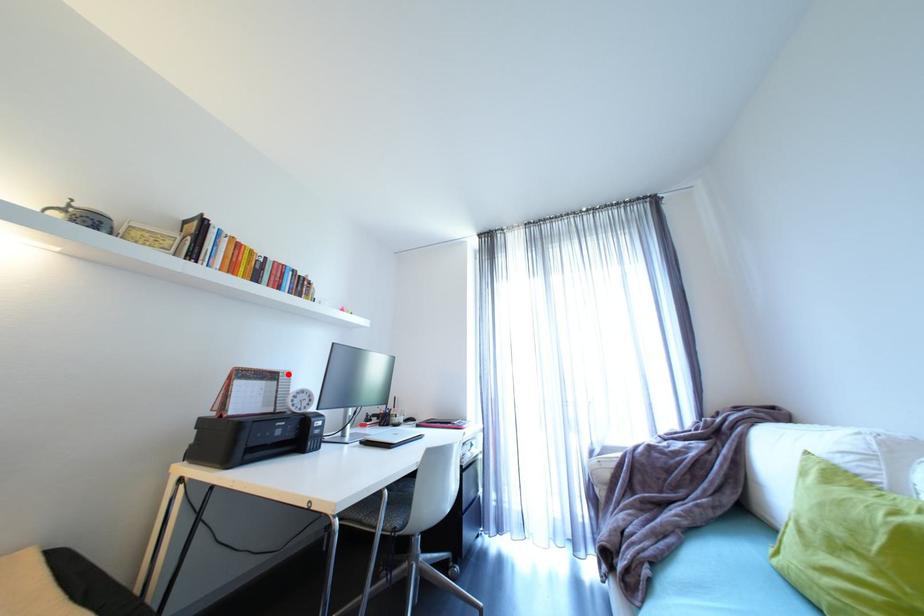
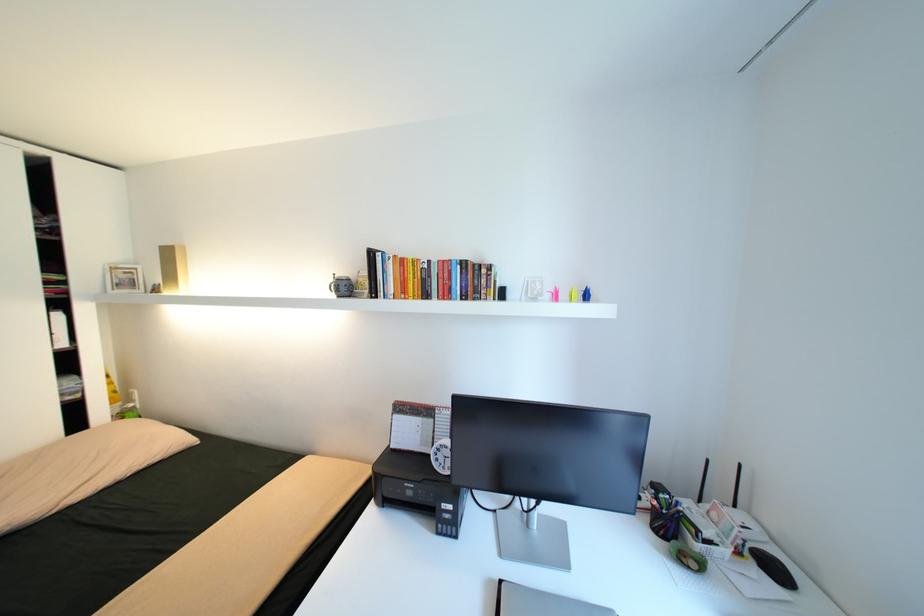
Where in the second image is the point corresponding to the highlighted location from the first image?

(444, 411)